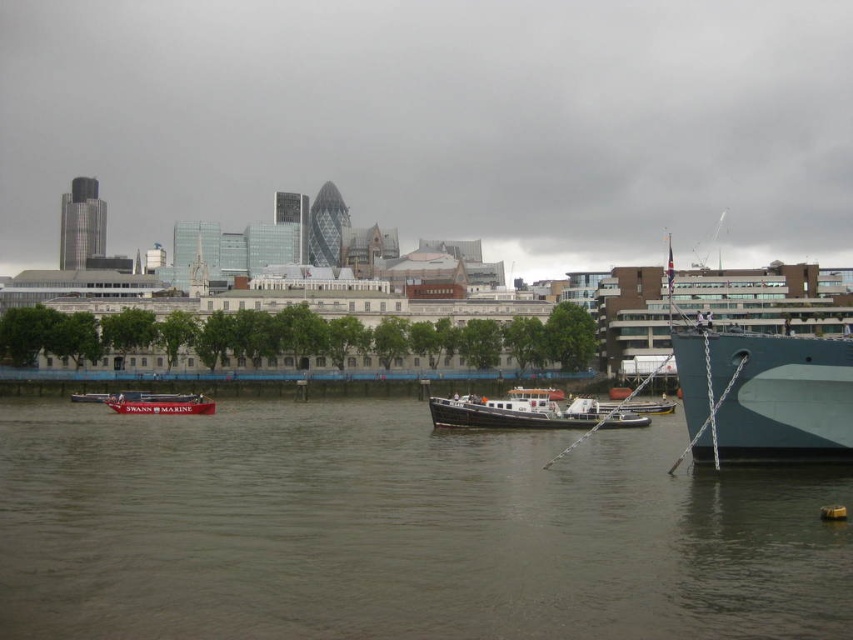
Who is more distant from viewer, (531,500) or (611,420)?

Point (611,420)

Can you confirm if brown water at lower center is positioned above black polished wood boat at center?

No, brown water at lower center is not above black polished wood boat at center.

Is point (262, 444) farther from camera compared to point (560, 412)?

No, it is not.

I want to click on brown water at lower center, so click(x=398, y=531).

Does point (820, 372) lie in front of point (164, 397)?

That is True.

Where is `teal matte ship at right`? The image size is (853, 640). teal matte ship at right is located at coordinates (763, 396).

Between point (300, 413) and point (115, 397), which one is positioned behind?

Point (300, 413)

Where is `brown water at lower center`? brown water at lower center is located at coordinates (398, 531).

Is point (378, 422) closer to camera compared to point (113, 400)?

Yes, point (378, 422) is in front of point (113, 400).

Locate an element on the screen. The height and width of the screenshot is (640, 853). brown water at lower center is located at coordinates (398, 531).